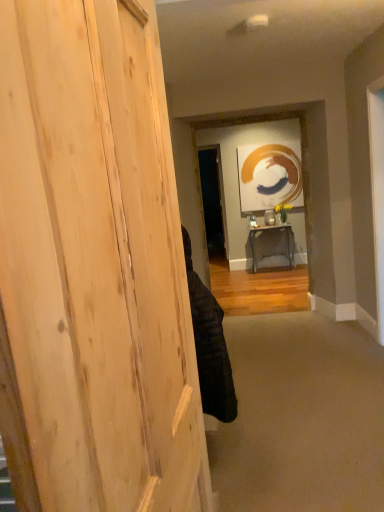
Question: Can you confirm if black fabric at center is smaller than beige carpet at lower center?

Choices:
 (A) yes
 (B) no

Answer: (A)

Question: Does black fabric at center have a greater height compared to beige carpet at lower center?

Choices:
 (A) no
 (B) yes

Answer: (B)

Question: Is beige carpet at lower center at the back of black fabric at center?

Choices:
 (A) yes
 (B) no

Answer: (B)

Question: Is black fabric at center bigger than beige carpet at lower center?

Choices:
 (A) yes
 (B) no

Answer: (B)

Question: Is black fabric at center at the left side of beige carpet at lower center?

Choices:
 (A) no
 (B) yes

Answer: (B)

Question: Considering the positions of black fabric at center and natural wood door at left in the image, is black fabric at center wider or thinner than natural wood door at left?

Choices:
 (A) wide
 (B) thin

Answer: (B)

Question: In the image, is black fabric at center positioned in front of or behind natural wood door at left?

Choices:
 (A) front
 (B) behind

Answer: (B)

Question: From the image's perspective, is black fabric at center above or below natural wood door at left?

Choices:
 (A) above
 (B) below

Answer: (B)

Question: From a real-world perspective, is black fabric at center above or below natural wood door at left?

Choices:
 (A) below
 (B) above

Answer: (A)

Question: From a real-world perspective, is black fabric at center above or below wooden table at center?

Choices:
 (A) above
 (B) below

Answer: (A)

Question: Based on their positions, is black fabric at center located to the left or right of wooden table at center?

Choices:
 (A) left
 (B) right

Answer: (A)

Question: Is point (211, 376) positioned closer to the camera than point (254, 258)?

Choices:
 (A) closer
 (B) farther

Answer: (A)

Question: Would you say black fabric at center is inside or outside wooden table at center?

Choices:
 (A) inside
 (B) outside

Answer: (B)

Question: Is wooden table at center spatially inside natural wood door at left, or outside of it?

Choices:
 (A) inside
 (B) outside

Answer: (B)

Question: From the image's perspective, is wooden table at center located above or below natural wood door at left?

Choices:
 (A) below
 (B) above

Answer: (B)